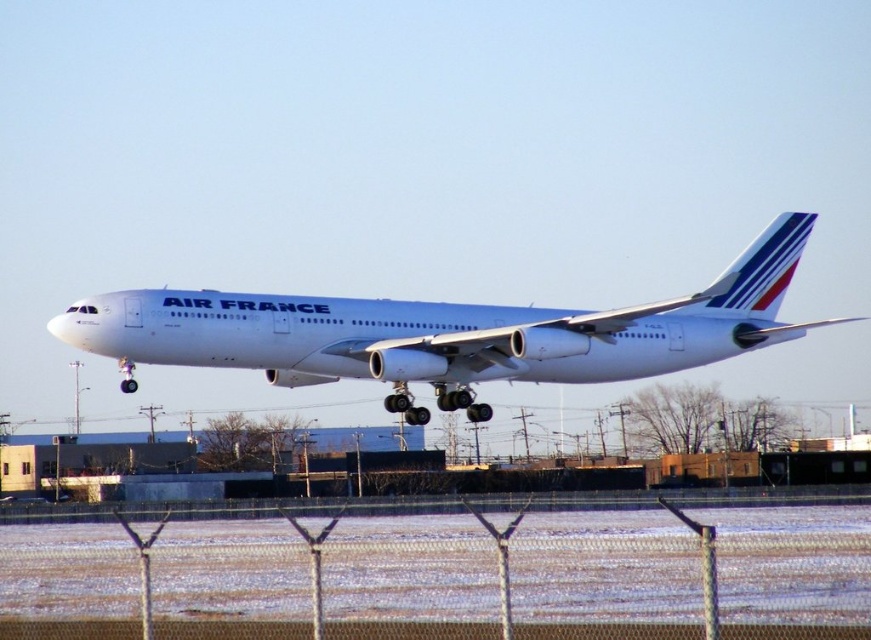
Between metallic chain-link fence at lower center and white metallic airplane at center, which one has less height?

white metallic airplane at center is shorter.

Is metallic chain-link fence at lower center taller than white metallic airplane at center?

Indeed, metallic chain-link fence at lower center has a greater height compared to white metallic airplane at center.

Which is behind, point (215, 554) or point (370, 362)?

The point (370, 362) is more distant.

You are a GUI agent. You are given a task and a screenshot of the screen. Output one action in this format:
    pyautogui.click(x=<x>, y=<y>)
    Task: Click on the metallic chain-link fence at lower center
    
    Given the screenshot: What is the action you would take?
    pyautogui.click(x=520, y=576)